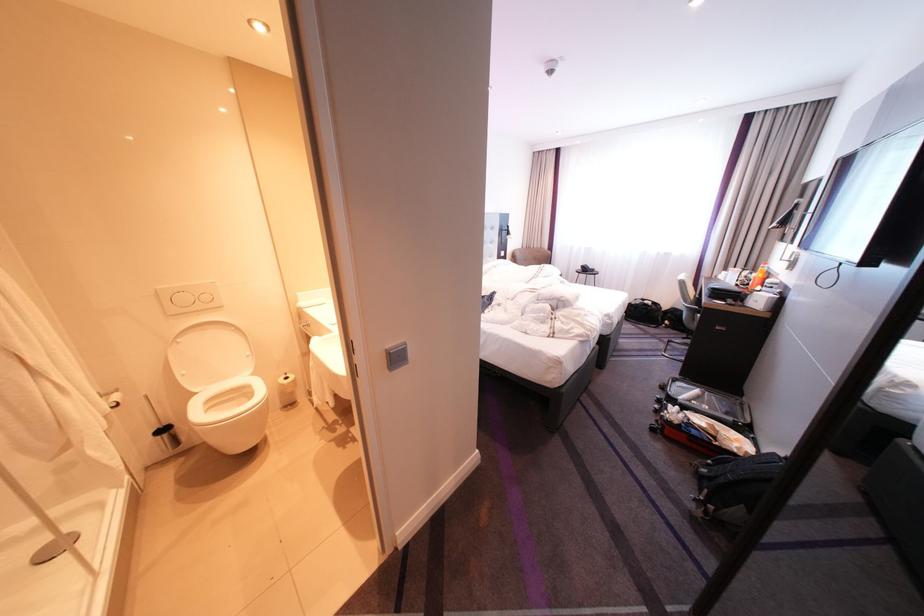
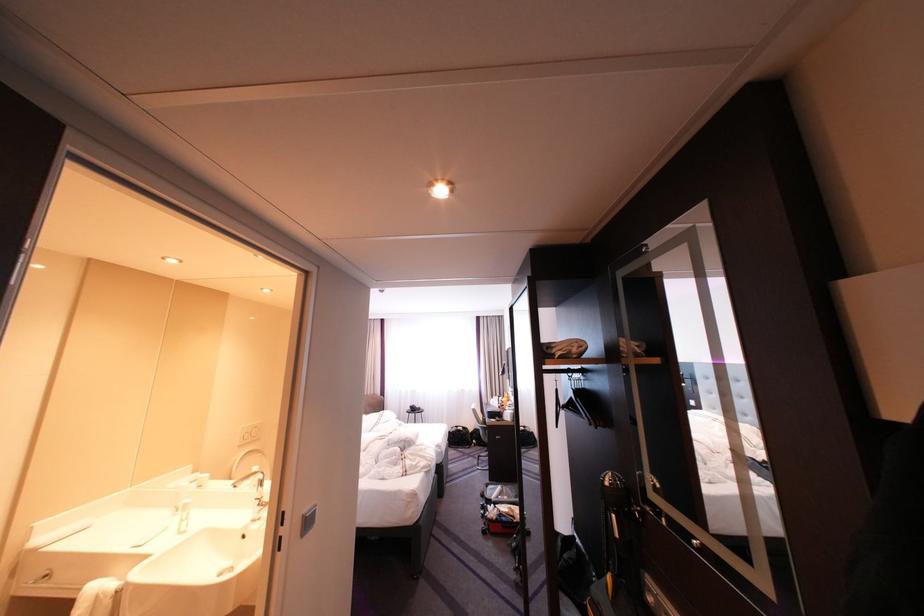
Where in the second image is the point corresponding to pixel 688 400 from the first image?

(503, 501)